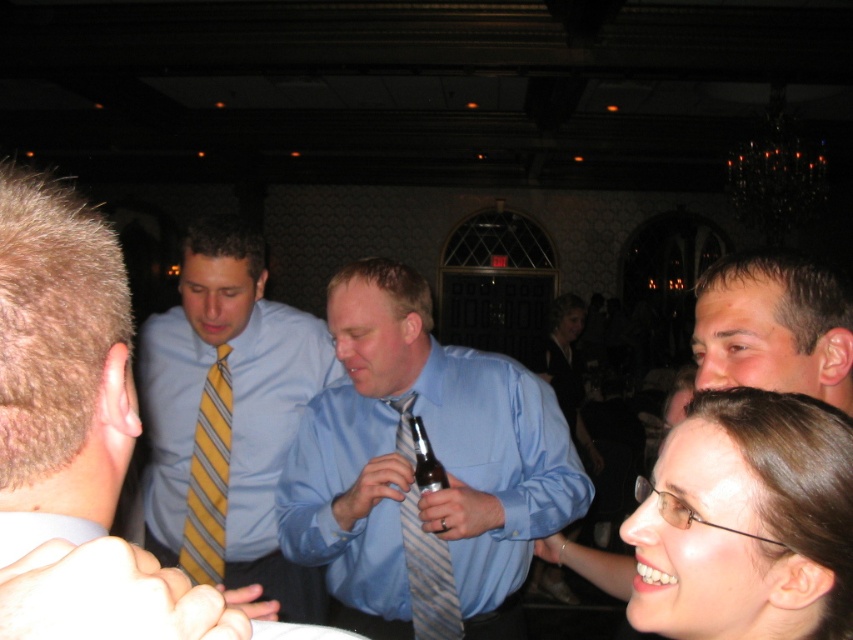
You are a photographer at the event and want to capture a photo of the blue satin shirt at center and smooth brown hair at lower right. Based on their heights, which one should you focus on first to ensure they are both in frame?

The blue satin shirt at center is taller than the smooth brown hair at lower right, so you should focus on the blue satin shirt at center first to ensure both are in frame.

You are a photographer at this event and want to capture a clear photo of both the yellow striped tie at left and the yellow striped tie at center. However, you notice that one of them is blocking the view of the other. Which tie is currently in front and might be obscuring the other?

The yellow striped tie at left is in front of the yellow striped tie at center, so it might be obscuring the other.

You are standing in the banquet hall and want to reach the point at coordinates point (296, 572). If your maximum reach is 7 feet, can you touch it without moving closer?

The point (296, 572) is 7.19 feet away from the viewer, which is slightly beyond your 7 feet reach. You cannot touch it without moving closer.